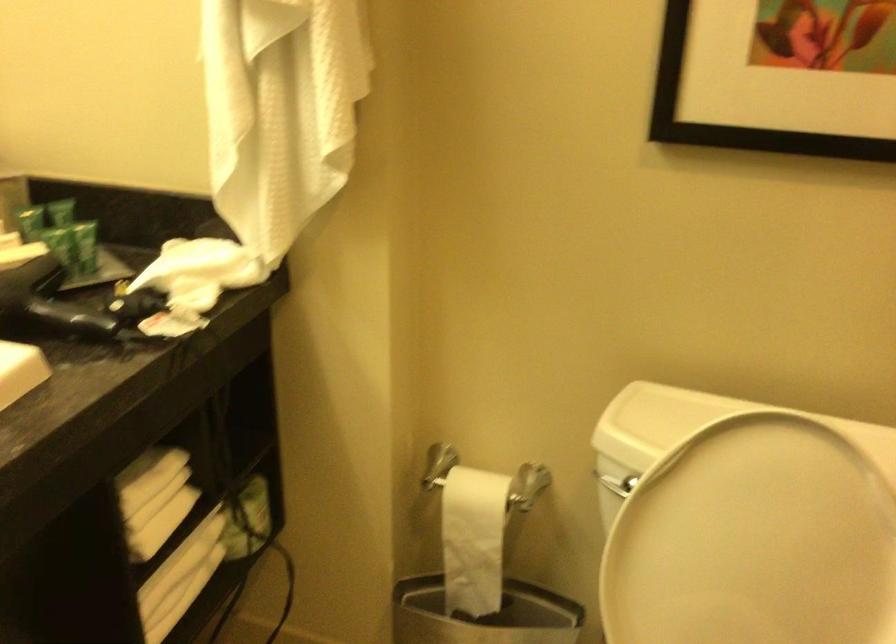
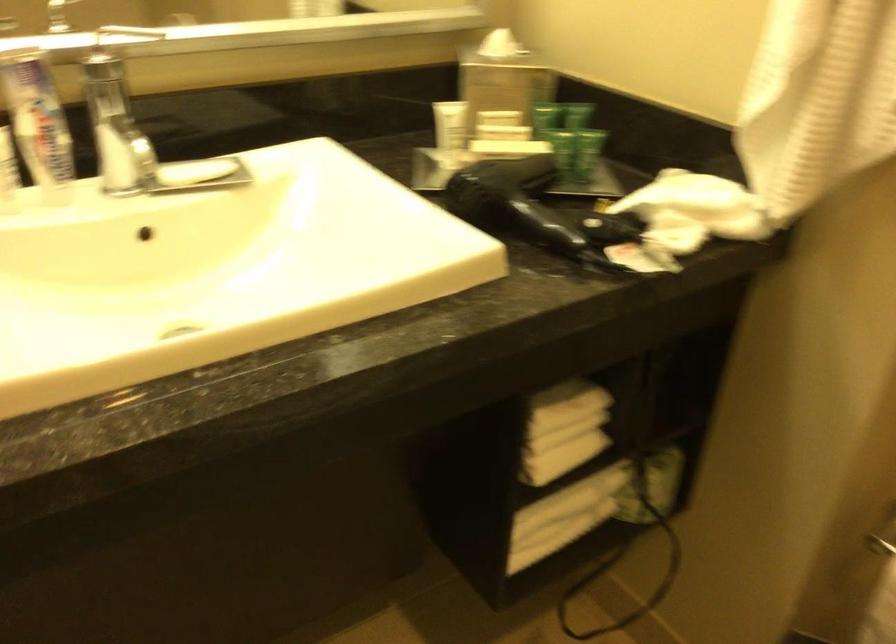
Question: The first image is from the beginning of the video and the second image is from the end. How did the camera likely rotate when shooting the video?

Choices:
 (A) Left
 (B) Right
 (C) Up
 (D) Down

Answer: (A)